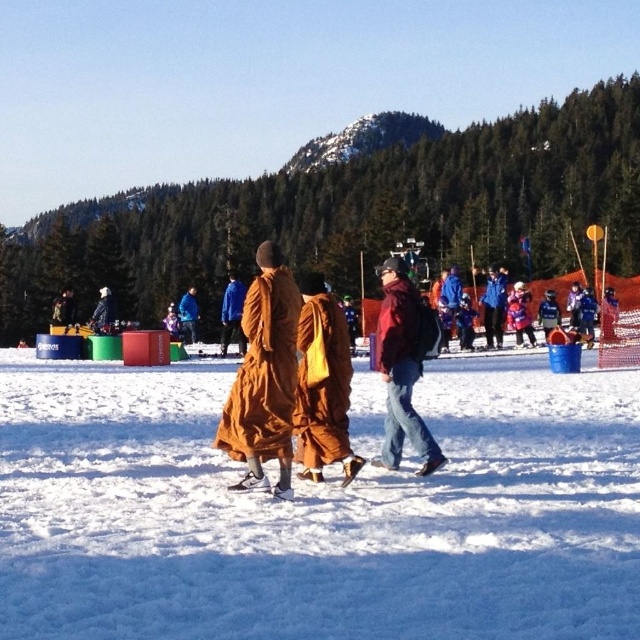
Can you confirm if brown fabric robe at center is wider than matte red jacket at center?

Yes, brown fabric robe at center is wider than matte red jacket at center.

The image size is (640, 640). What are the coordinates of `brown fabric robe at center` in the screenshot? It's located at (264, 378).

Between white fluffy snow at center and matte red jacket at center, which one has more height?

Standing taller between the two is matte red jacket at center.

Can you confirm if white fluffy snow at center is shorter than matte red jacket at center?

Yes, white fluffy snow at center is shorter than matte red jacket at center.

Between point (564, 596) and point (388, 417), which one is positioned in front?

Point (564, 596) is more forward.

Locate an element on the screen. The height and width of the screenshot is (640, 640). white fluffy snow at center is located at coordinates (317, 513).

From the picture: Does white fluffy snow at center appear on the left side of brown fabric robe at center?

No, white fluffy snow at center is not to the left of brown fabric robe at center.

Which is in front, point (372, 529) or point (269, 408)?

Point (372, 529)

Between point (122, 604) and point (227, 433), which one is positioned behind?

The point (227, 433) is behind.

Find the location of `white fluffy snow at center`. white fluffy snow at center is located at coordinates (317, 513).